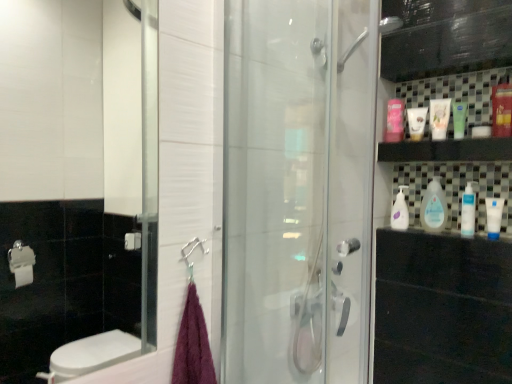
Question: Is white matte tube at upper right, the 5th mouthwash when ordered from right to left, not close to purple fluffy towel at lower left?

Choices:
 (A) yes
 (B) no

Answer: (A)

Question: Is white matte tube at upper right, the 2th mouthwash in the left-to-right sequence, looking in the opposite direction of purple fluffy towel at lower left?

Choices:
 (A) no
 (B) yes

Answer: (A)

Question: Considering the relative sizes of white matte tube at upper right, the 5th mouthwash when ordered from right to left, and purple fluffy towel at lower left in the image provided, is white matte tube at upper right, the 5th mouthwash when ordered from right to left, shorter than purple fluffy towel at lower left?

Choices:
 (A) no
 (B) yes

Answer: (B)

Question: From the image's perspective, is white matte tube at upper right, the 2th mouthwash in the left-to-right sequence, above purple fluffy towel at lower left?

Choices:
 (A) yes
 (B) no

Answer: (A)

Question: Does white matte tube at upper right, the 2th mouthwash in the left-to-right sequence, have a greater height compared to purple fluffy towel at lower left?

Choices:
 (A) no
 (B) yes

Answer: (A)

Question: Considering the relative positions of white matte tube at upper right, the 2th mouthwash in the left-to-right sequence, and purple fluffy towel at lower left in the image provided, is white matte tube at upper right, the 2th mouthwash in the left-to-right sequence, to the right of purple fluffy towel at lower left from the viewer's perspective?

Choices:
 (A) no
 (B) yes

Answer: (B)

Question: Is transparent glass shower door at center touching white glossy tube at upper right, arranged as the third mouthwash when viewed from the left?

Choices:
 (A) no
 (B) yes

Answer: (A)

Question: Is transparent glass shower door at center smaller than white glossy tube at upper right, arranged as the third mouthwash when viewed from the left?

Choices:
 (A) no
 (B) yes

Answer: (A)

Question: Is transparent glass shower door at center not close to white glossy tube at upper right, the fourth mouthwash positioned from the right?

Choices:
 (A) yes
 (B) no

Answer: (B)

Question: Is transparent glass shower door at center oriented away from white glossy tube at upper right, arranged as the third mouthwash when viewed from the left?

Choices:
 (A) yes
 (B) no

Answer: (A)

Question: Is transparent glass shower door at center to the left of white glossy tube at upper right, arranged as the third mouthwash when viewed from the left, from the viewer's perspective?

Choices:
 (A) no
 (B) yes

Answer: (B)

Question: Considering the relative sizes of transparent glass shower door at center and white glossy tube at upper right, the fourth mouthwash positioned from the right, in the image provided, is transparent glass shower door at center bigger than white glossy tube at upper right, the fourth mouthwash positioned from the right,?

Choices:
 (A) no
 (B) yes

Answer: (B)

Question: From the image's perspective, is white glossy bottle at right, which is counted as the 1th cleaning product, starting from the front, located above white glossy bottle at upper right, the first cleaning product viewed from the left?

Choices:
 (A) no
 (B) yes

Answer: (B)